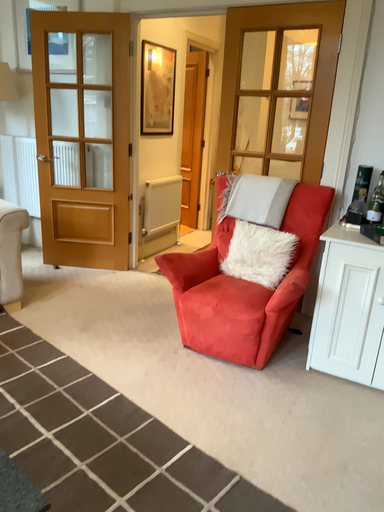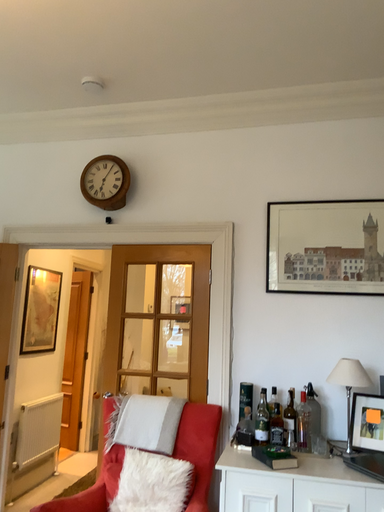
Question: Which way did the camera rotate in the video?

Choices:
 (A) rotated left
 (B) rotated right

Answer: (B)